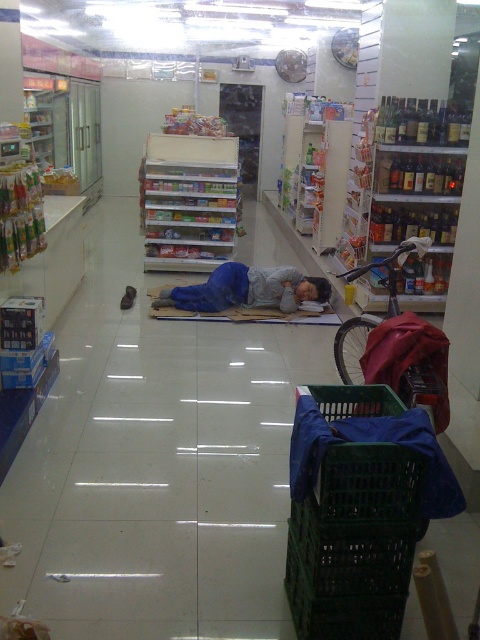
Question: Which is farther from the green plastic shopping cart at center-right?

Choices:
 (A) green plastic crate at lower right
 (B) blue fabric sleeping bag at center

Answer: (B)

Question: Is green plastic shopping cart at center-right closer to the viewer compared to blue fabric sleeping bag at center?

Choices:
 (A) yes
 (B) no

Answer: (A)

Question: Can you confirm if green plastic shopping cart at center-right is positioned to the right of blue fabric sleeping bag at center?

Choices:
 (A) no
 (B) yes

Answer: (B)

Question: Can you confirm if green plastic crate at lower right is wider than green plastic shopping cart at center-right?

Choices:
 (A) no
 (B) yes

Answer: (B)

Question: Which of the following is the closest to the observer?

Choices:
 (A) [360, 448]
 (B) [213, 289]
 (C) [336, 276]

Answer: (A)

Question: Which point appears farthest from the camera in this image?

Choices:
 (A) (440, 352)
 (B) (164, 300)

Answer: (B)